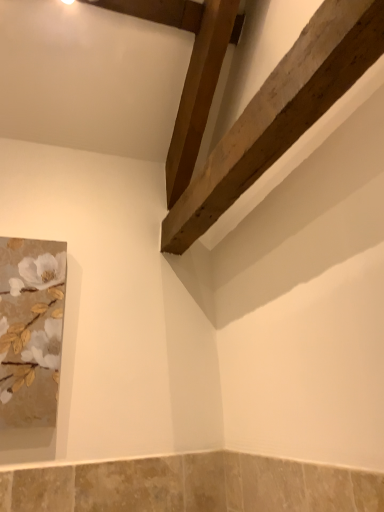
This screenshot has width=384, height=512. Describe the element at coordinates (31, 319) in the screenshot. I see `matte gold leaf at left` at that location.

The image size is (384, 512). In order to click on matte gold leaf at left in this screenshot , I will do `click(31, 319)`.

I want to click on matte gold leaf at left, so click(x=31, y=319).